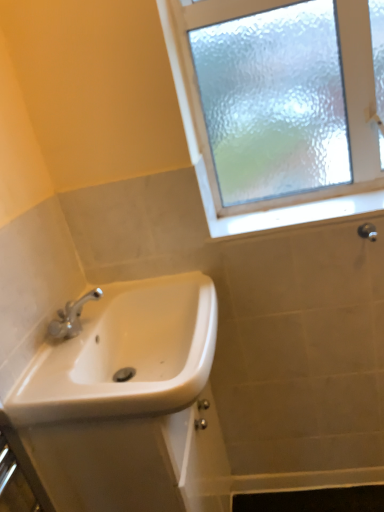
Find the location of `white ceramic sink at lower left`. white ceramic sink at lower left is located at coordinates (120, 396).

Where is `white glossy window sill at upper right`? white glossy window sill at upper right is located at coordinates (287, 212).

You are a GUI agent. You are given a task and a screenshot of the screen. Output one action in this format:
    pyautogui.click(x=<x>, y=<y>)
    Task: Click on the white ceramic sink at lower left
    Image resolution: width=384 pixels, height=512 pixels.
    Given the screenshot: What is the action you would take?
    pyautogui.click(x=120, y=396)

Is white ceramic sink at lower left not within frosted glass window at upper right?

That's correct, white ceramic sink at lower left is outside of frosted glass window at upper right.

Which point is more forward, (182,342) or (201,157)?

Point (182,342)

Considering the positions of objects white ceramic sink at lower left and frosted glass window at upper right in the image provided, who is more to the right, white ceramic sink at lower left or frosted glass window at upper right?

frosted glass window at upper right.

From a real-world perspective, is white ceramic sink at lower left above or below frosted glass window at upper right?

In terms of real-world spatial position, white ceramic sink at lower left is below frosted glass window at upper right.

From a real-world perspective, which object stands above the other?

frosted glass window at upper right.

From the image's perspective, which one is positioned lower, white glossy window sill at upper right or frosted glass window at upper right?

From the image's view, white glossy window sill at upper right is below.

Who is bigger, white glossy window sill at upper right or frosted glass window at upper right?

frosted glass window at upper right is bigger.

Measure the distance between white glossy window sill at upper right and frosted glass window at upper right.

1.74 inches.

Considering the relative positions of white ceramic sink at lower left and white glossy window sill at upper right in the image provided, is white ceramic sink at lower left to the left of white glossy window sill at upper right from the viewer's perspective?

Correct, you'll find white ceramic sink at lower left to the left of white glossy window sill at upper right.

Between white ceramic sink at lower left and white glossy window sill at upper right, which one has smaller width?

With smaller width is white glossy window sill at upper right.

Is white ceramic sink at lower left turned away from white glossy window sill at upper right?

That's not correct — white ceramic sink at lower left is not looking away from white glossy window sill at upper right.

Locate an element on the screen. The width and height of the screenshot is (384, 512). sink in front of the white glossy window sill at upper right is located at coordinates click(120, 396).

Which is closer to the camera, (202, 172) or (152, 450)?

Point (202, 172).

Is frosted glass window at upper right facing away from white ceramic sink at lower left?

No, white ceramic sink at lower left is not at the back of frosted glass window at upper right.

Considering the positions of objects frosted glass window at upper right and white ceramic sink at lower left in the image provided, who is more to the right, frosted glass window at upper right or white ceramic sink at lower left?

Positioned to the right is frosted glass window at upper right.

Does point (379, 208) come behind point (176, 319)?

No, (379, 208) is closer to viewer.

Considering the relative sizes of white glossy window sill at upper right and white ceramic sink at lower left in the image provided, is white glossy window sill at upper right thinner than white ceramic sink at lower left?

Correct, the width of white glossy window sill at upper right is less than that of white ceramic sink at lower left.

You are a GUI agent. You are given a task and a screenshot of the screen. Output one action in this format:
    pyautogui.click(x=<x>, y=<y>)
    Task: Click on the window sill that is behind the white ceramic sink at lower left
    This screenshot has width=384, height=512.
    Given the screenshot: What is the action you would take?
    (x=287, y=212)

Consider the image. Who is smaller, white glossy window sill at upper right or matte silver shower at upper right?

Smaller between the two is matte silver shower at upper right.

Considering the points (288, 223) and (365, 223), which point is behind, point (288, 223) or point (365, 223)?

The point (288, 223) is farther from the camera.

Considering their positions, is white glossy window sill at upper right located in front of or behind matte silver shower at upper right?

Visually, white glossy window sill at upper right is located behind matte silver shower at upper right.

From a real-world perspective, is frosted glass window at upper right physically below white glossy window sill at upper right?

Actually, frosted glass window at upper right is physically above white glossy window sill at upper right in the real world.

In the scene shown: Is frosted glass window at upper right outside of white glossy window sill at upper right?

Yes, frosted glass window at upper right is located beyond the bounds of white glossy window sill at upper right.

From the picture: Is frosted glass window at upper right next to white glossy window sill at upper right?

Yes, frosted glass window at upper right is touching white glossy window sill at upper right.

Considering the positions of objects frosted glass window at upper right and white glossy window sill at upper right in the image provided, who is more to the left, frosted glass window at upper right or white glossy window sill at upper right?

frosted glass window at upper right.

The width and height of the screenshot is (384, 512). What are the coordinates of `sink that appears below the frosted glass window at upper right (from a real-world perspective)` in the screenshot? It's located at (120, 396).

The height and width of the screenshot is (512, 384). What are the coordinates of `window located on the left of white glossy window sill at upper right` in the screenshot? It's located at (209, 180).

Considering their positions, is white ceramic sink at lower left positioned closer to white glossy window sill at upper right than matte silver shower at upper right?

The object closer to white glossy window sill at upper right is matte silver shower at upper right.

Based on their spatial positions, is white ceramic sink at lower left or frosted glass window at upper right further from matte silver shower at upper right?

white ceramic sink at lower left.

When comparing their distances from frosted glass window at upper right, does white glossy window sill at upper right or white ceramic sink at lower left seem closer?

white glossy window sill at upper right.

Estimate the real-world distances between objects in this image. Which object is closer to white ceramic sink at lower left, matte silver shower at upper right or frosted glass window at upper right?

frosted glass window at upper right is positioned closer to the anchor white ceramic sink at lower left.

Estimate the real-world distances between objects in this image. Which object is further from white glossy window sill at upper right, white ceramic sink at lower left or frosted glass window at upper right?

white ceramic sink at lower left.

Consider the image. Which object lies nearer to the anchor point white glossy window sill at upper right, frosted glass window at upper right or matte silver shower at upper right?

Among the two, frosted glass window at upper right is located nearer to white glossy window sill at upper right.

Looking at the image, which one is located closer to matte silver shower at upper right, white glossy window sill at upper right or white ceramic sink at lower left?

white glossy window sill at upper right.

Looking at the image, which one is located further to frosted glass window at upper right, matte silver shower at upper right or white glossy window sill at upper right?

matte silver shower at upper right is positioned further to the anchor frosted glass window at upper right.

Locate an element on the screen. The height and width of the screenshot is (512, 384). shower between frosted glass window at upper right and white ceramic sink at lower left in the up-down direction is located at coordinates (367, 231).

This screenshot has width=384, height=512. Find the location of `shower between white glossy window sill at upper right and white ceramic sink at lower left in the up-down direction`. shower between white glossy window sill at upper right and white ceramic sink at lower left in the up-down direction is located at coordinates (367, 231).

Locate an element on the screen. The image size is (384, 512). window sill that lies between frosted glass window at upper right and matte silver shower at upper right from top to bottom is located at coordinates (287, 212).

This screenshot has height=512, width=384. Find the location of `window sill between frosted glass window at upper right and white ceramic sink at lower left in the up-down direction`. window sill between frosted glass window at upper right and white ceramic sink at lower left in the up-down direction is located at coordinates (287, 212).